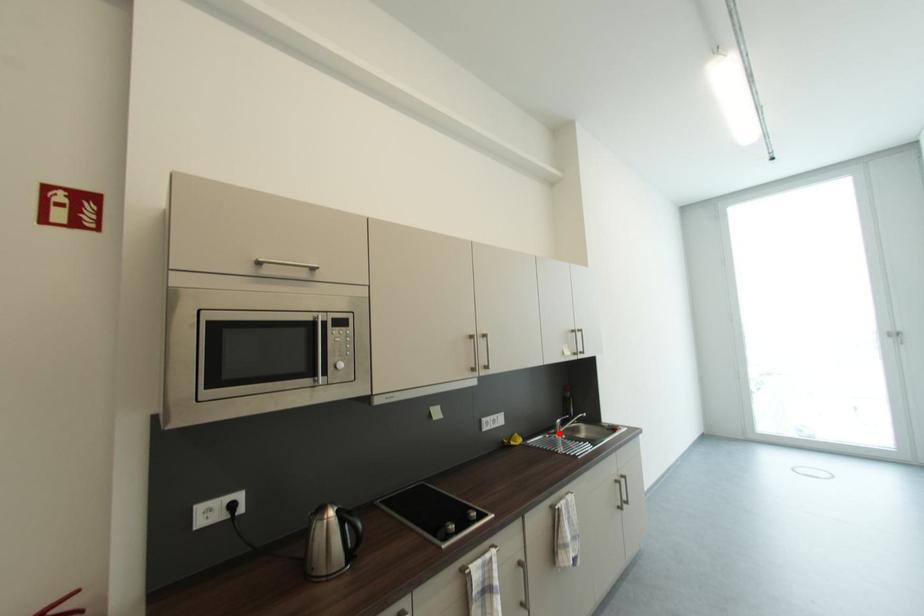
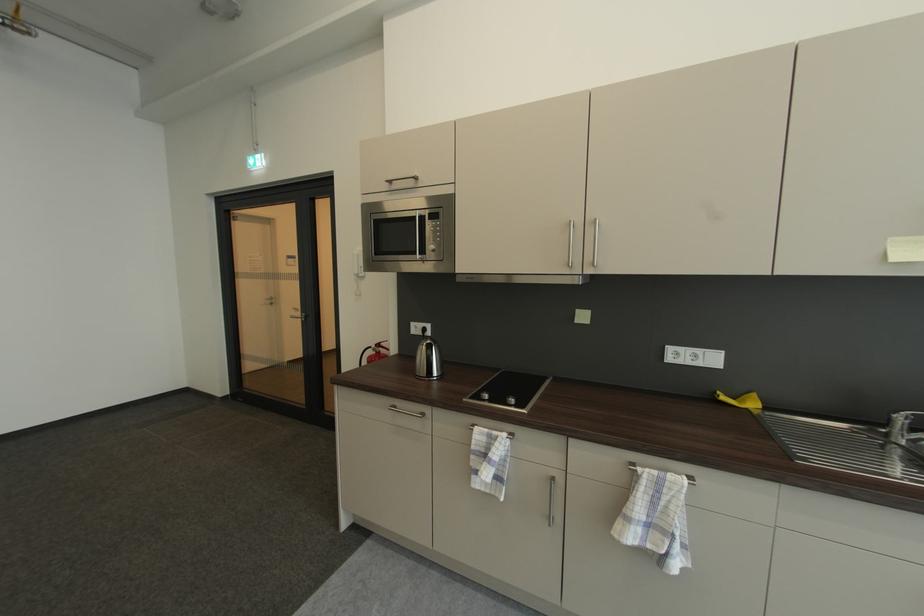
Find the pixel in the second image that matches the highlighted location in the first image.

(892, 432)